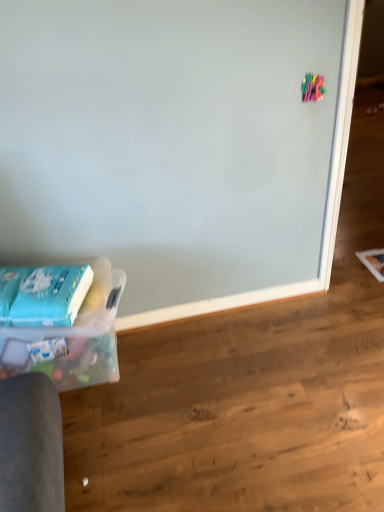
Locate an element on the screen. The width and height of the screenshot is (384, 512). blue matte paperback book at lower left is located at coordinates (51, 296).

The width and height of the screenshot is (384, 512). What do you see at coordinates (51, 296) in the screenshot?
I see `blue matte paperback book at lower left` at bounding box center [51, 296].

This screenshot has width=384, height=512. Describe the element at coordinates (73, 338) in the screenshot. I see `clear plastic container at lower left` at that location.

At what (x,y) coordinates should I click in order to perform the action: click on clear plastic container at lower left. Please return your answer as a coordinate pair (x, y). The width and height of the screenshot is (384, 512). Looking at the image, I should click on (73, 338).

Measure the distance between clear plastic container at lower left and camera.

The depth of clear plastic container at lower left is 5.02 feet.

This screenshot has width=384, height=512. Find the location of `blue matte paperback book at lower left`. blue matte paperback book at lower left is located at coordinates (51, 296).

Which is more to the left, clear plastic container at lower left or blue matte paperback book at lower left?

blue matte paperback book at lower left.

Considering their positions, is clear plastic container at lower left located in front of or behind blue matte paperback book at lower left?

In the image, clear plastic container at lower left appears in front of blue matte paperback book at lower left.

Does point (79, 358) appear closer or farther from the camera than point (39, 286)?

Point (79, 358) is farther from the camera than point (39, 286).

From the image's perspective, which is above, clear plastic container at lower left or blue matte paperback book at lower left?

blue matte paperback book at lower left appears higher in the image.

From a real-world perspective, between clear plastic container at lower left and blue matte paperback book at lower left, who is vertically higher?

blue matte paperback book at lower left is physically above.

Which of these two, clear plastic container at lower left or blue matte paperback book at lower left, is wider?

Wider between the two is clear plastic container at lower left.

Considering the relative sizes of clear plastic container at lower left and blue matte paperback book at lower left in the image provided, is clear plastic container at lower left shorter than blue matte paperback book at lower left?

No, clear plastic container at lower left is not shorter than blue matte paperback book at lower left.

Considering the relative sizes of clear plastic container at lower left and blue matte paperback book at lower left in the image provided, is clear plastic container at lower left bigger than blue matte paperback book at lower left?

Correct, clear plastic container at lower left is larger in size than blue matte paperback book at lower left.

Is clear plastic container at lower left not within blue matte paperback book at lower left?

clear plastic container at lower left is positioned outside blue matte paperback book at lower left.

Are clear plastic container at lower left and blue matte paperback book at lower left located far from each other?

No.

In the scene shown: Is clear plastic container at lower left turned away from blue matte paperback book at lower left?

clear plastic container at lower left does not have its back to blue matte paperback book at lower left.

What's the angular difference between clear plastic container at lower left and blue matte paperback book at lower left's facing directions?

clear plastic container at lower left and blue matte paperback book at lower left are facing 16.8 degrees away from each other.

At what (x,y) coordinates should I click in order to perform the action: click on box below the blue matte paperback book at lower left (from the image's perspective). Please return your answer as a coordinate pair (x, y). The height and width of the screenshot is (512, 384). Looking at the image, I should click on click(x=73, y=338).

Considering the relative positions of blue matte paperback book at lower left and clear plastic container at lower left in the image provided, is blue matte paperback book at lower left to the right of clear plastic container at lower left from the viewer's perspective?

In fact, blue matte paperback book at lower left is to the left of clear plastic container at lower left.

Which object is further away from the camera, blue matte paperback book at lower left or clear plastic container at lower left?

blue matte paperback book at lower left is behind.

Is point (19, 324) in front of point (121, 271)?

Yes.

From the image's perspective, which one is positioned higher, blue matte paperback book at lower left or clear plastic container at lower left?

blue matte paperback book at lower left.

From a real-world perspective, between blue matte paperback book at lower left and clear plastic container at lower left, who is vertically lower?

clear plastic container at lower left, from a real-world perspective.

Is blue matte paperback book at lower left thinner than clear plastic container at lower left?

Indeed, blue matte paperback book at lower left has a lesser width compared to clear plastic container at lower left.

Looking at this image, which of these two, blue matte paperback book at lower left or clear plastic container at lower left, stands taller?

Standing taller between the two is clear plastic container at lower left.

Considering the sizes of blue matte paperback book at lower left and clear plastic container at lower left in the image, is blue matte paperback book at lower left bigger or smaller than clear plastic container at lower left?

Clearly, blue matte paperback book at lower left is smaller in size than clear plastic container at lower left.

Is blue matte paperback book at lower left positioned beyond the bounds of clear plastic container at lower left?

blue matte paperback book at lower left is positioned outside clear plastic container at lower left.

Is there a large distance between blue matte paperback book at lower left and clear plastic container at lower left?

Actually, blue matte paperback book at lower left and clear plastic container at lower left are a little close together.

Consider the image. Could you tell me if blue matte paperback book at lower left is facing clear plastic container at lower left?

No, blue matte paperback book at lower left is not oriented towards clear plastic container at lower left.

How distant is blue matte paperback book at lower left from clear plastic container at lower left?

blue matte paperback book at lower left is 6.66 inches from clear plastic container at lower left.

Identify the location of paperback book behind the clear plastic container at lower left. The image size is (384, 512). (51, 296).

In order to click on box below the blue matte paperback book at lower left (from the image's perspective) in this screenshot , I will do click(x=73, y=338).

Find the location of a particular element. box that is under the blue matte paperback book at lower left (from a real-world perspective) is located at coordinates (73, 338).